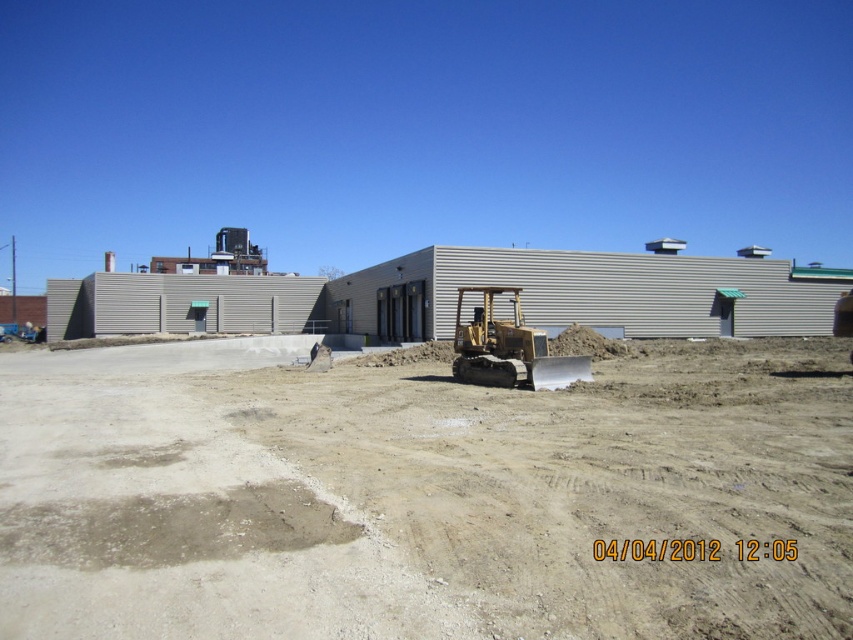
Is brown sandy dirt at center closer to camera compared to gold metallic excavator at center?

Yes.

Consider the image. Between brown sandy dirt at center and gold metallic excavator at center, which one appears on the right side from the viewer's perspective?

gold metallic excavator at center is more to the right.

What are the coordinates of `brown sandy dirt at center` in the screenshot? It's located at (415, 499).

Where is `brown sandy dirt at center`? This screenshot has width=853, height=640. brown sandy dirt at center is located at coordinates click(415, 499).